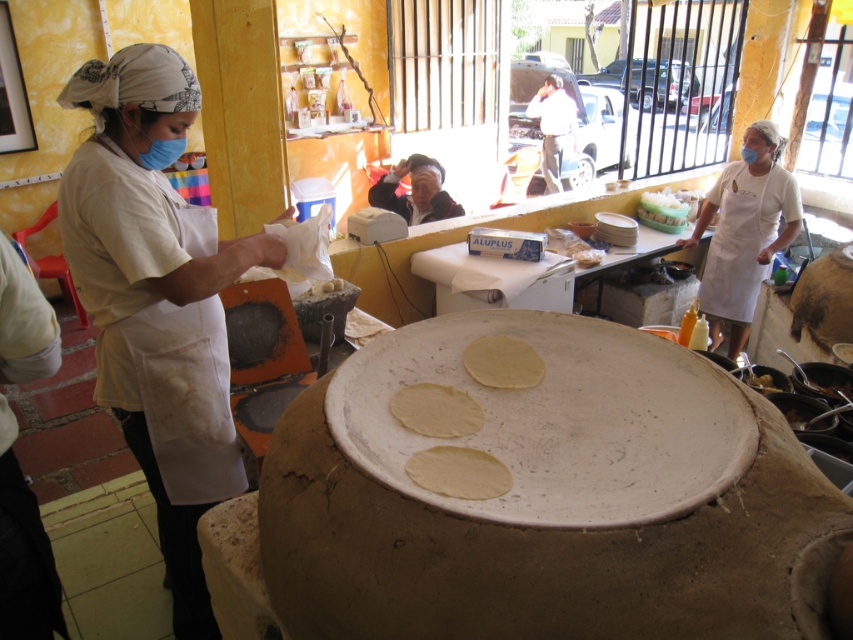
Who is taller, yellow matte tortilla at center or yellowish matte tortilla at center?

Standing taller between the two is yellow matte tortilla at center.

Identify the location of yellow matte tortilla at center. (502, 362).

Is point (538, 371) more distant than point (775, 388)?

No, (538, 371) is in front of (775, 388).

You are a GUI agent. You are given a task and a screenshot of the screen. Output one action in this format:
    pyautogui.click(x=<x>, y=<y>)
    Task: Click on the yellow matte tortilla at center
    
    Given the screenshot: What is the action you would take?
    pyautogui.click(x=502, y=362)

Can you confirm if light brown dough at center is taller than yellowish matte tortilla at center?

Yes, light brown dough at center is taller than yellowish matte tortilla at center.

Does point (393, 404) lie behind point (767, 381)?

No, (393, 404) is in front of (767, 381).

Locate an element on the screen. light brown dough at center is located at coordinates pyautogui.click(x=436, y=410).

The height and width of the screenshot is (640, 853). What are the coordinates of `light brown dough at center` in the screenshot? It's located at (436, 410).

Is white matte apron at left taller than white apron at right?

Yes.

Is point (126, 333) closer to viewer compared to point (775, 145)?

Yes, point (126, 333) is in front of point (775, 145).

At what (x,y) coordinates should I click in order to perform the action: click on white matte apron at left. Please return your answer as a coordinate pair (x, y). Looking at the image, I should click on (155, 298).